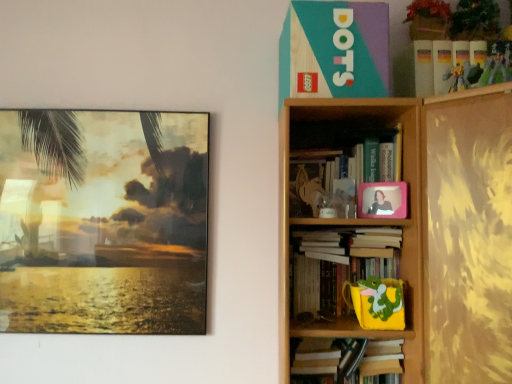
Question: Is the depth of white paper at center, arranged as the 2th book when ordered from the bottom, greater than that of wooden bookshelf at upper right?

Choices:
 (A) no
 (B) yes

Answer: (B)

Question: Is white paper at center, arranged as the 2th book when ordered from the bottom, bigger than wooden bookshelf at upper right?

Choices:
 (A) no
 (B) yes

Answer: (A)

Question: Does white paper at center, arranged as the 2th book when ordered from the bottom, appear on the right side of wooden bookshelf at upper right?

Choices:
 (A) no
 (B) yes

Answer: (A)

Question: Does white paper at center, positioned as the 3th book in top-to-bottom order, have a lesser height compared to wooden bookshelf at upper right?

Choices:
 (A) yes
 (B) no

Answer: (A)

Question: From a real-world perspective, is white paper at center, positioned as the 3th book in top-to-bottom order, on wooden bookshelf at upper right?

Choices:
 (A) no
 (B) yes

Answer: (B)

Question: Considering the positions of yellow matte cup at lower right, the first toy when ordered from left to right, and hardcover book at upper right, the first book when ordered from bottom to top, in the image, is yellow matte cup at lower right, the first toy when ordered from left to right, wider or thinner than hardcover book at upper right, the first book when ordered from bottom to top,?

Choices:
 (A) thin
 (B) wide

Answer: (A)

Question: Based on their positions, is yellow matte cup at lower right, which ranks as the third toy in top-to-bottom order, located to the left or right of hardcover book at upper right, which is the fourth book in top-to-bottom order?

Choices:
 (A) right
 (B) left

Answer: (A)

Question: Is yellow matte cup at lower right, marked as the 3th toy in a right-to-left arrangement, spatially inside hardcover book at upper right, which is the fourth book in top-to-bottom order, or outside of it?

Choices:
 (A) inside
 (B) outside

Answer: (B)

Question: From a real-world perspective, is yellow matte cup at lower right, which appears as the first toy when viewed from the back, positioned above or below hardcover book at upper right, which is the fourth book in top-to-bottom order?

Choices:
 (A) above
 (B) below

Answer: (B)

Question: From their relative heights in the image, would you say plastic action figure at upper right, arranged as the 3th toy when ordered from the bottom, is taller or shorter than matte glass painting at left, the first picture frame from the left?

Choices:
 (A) short
 (B) tall

Answer: (A)

Question: Considering their positions, is plastic action figure at upper right, which ranks as the second toy in front-to-back order, located in front of or behind matte glass painting at left, which ranks as the first picture frame in back-to-front order?

Choices:
 (A) behind
 (B) front

Answer: (B)

Question: In terms of width, does plastic action figure at upper right, which is the 2th toy from left to right, look wider or thinner when compared to matte glass painting at left, which ranks as the first picture frame in back-to-front order?

Choices:
 (A) wide
 (B) thin

Answer: (B)

Question: Is point (460, 87) closer or farther from the camera than point (75, 276)?

Choices:
 (A) closer
 (B) farther

Answer: (A)

Question: From the image's perspective, is wooden bookshelf at upper right above or below yellow matte cup at lower right, which appears as the first toy when viewed from the back?

Choices:
 (A) above
 (B) below

Answer: (A)

Question: Does point (479, 107) appear closer or farther from the camera than point (345, 289)?

Choices:
 (A) closer
 (B) farther

Answer: (A)